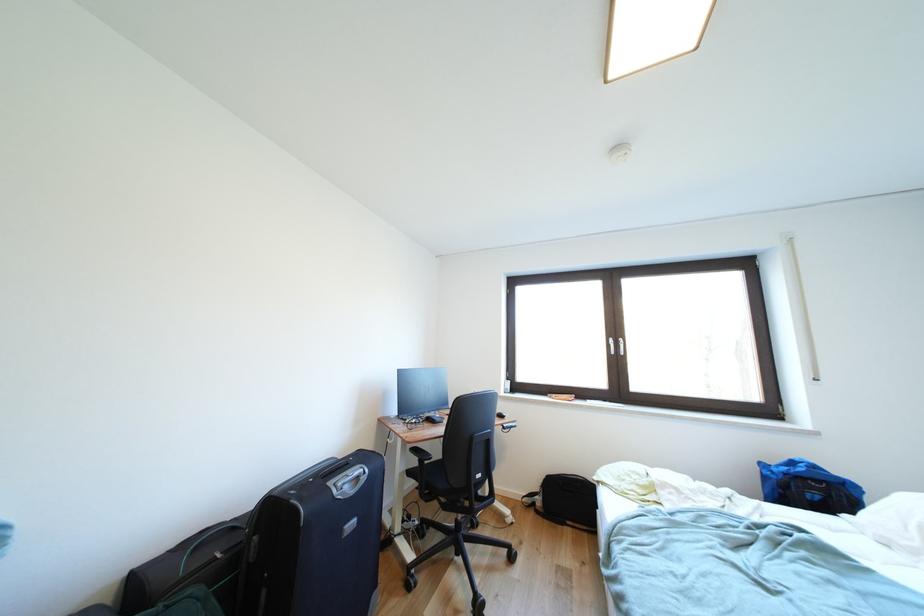
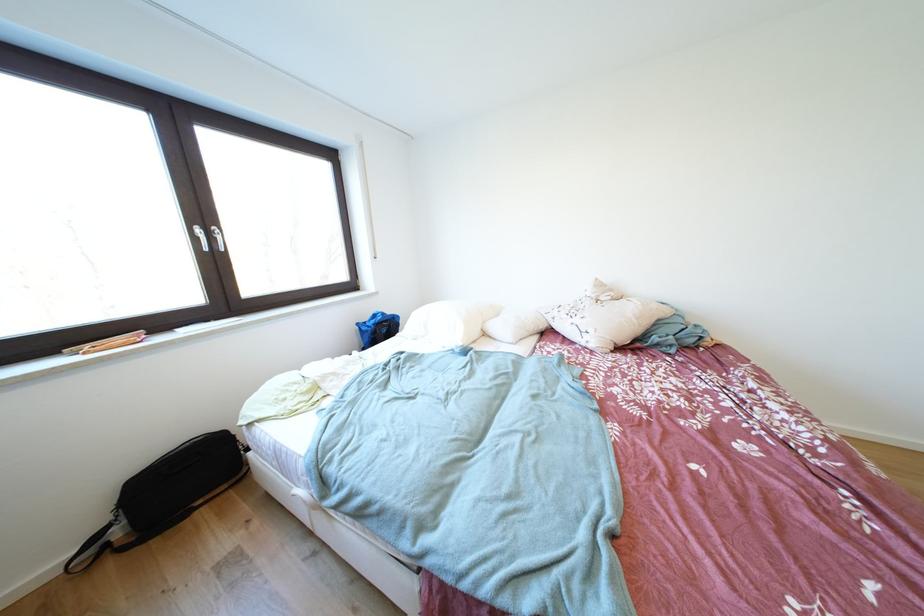
First-person continuous shooting, in which direction is the camera rotating?

The rotation direction of the camera is right-down.